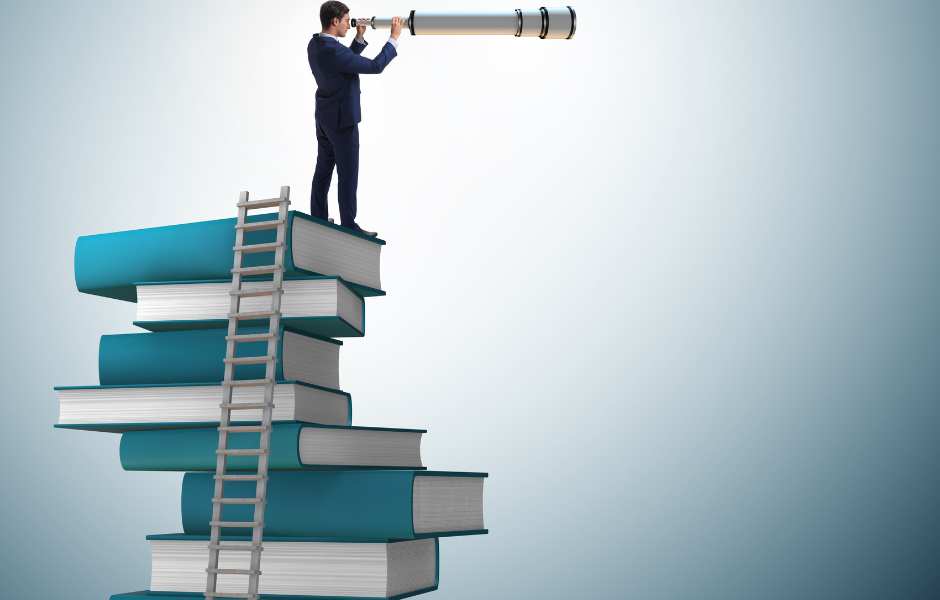
Find the location of a particular element. The image size is (940, 600). book is located at coordinates (127, 595), (171, 559), (202, 518), (164, 440), (158, 414), (175, 355), (178, 312), (155, 249).